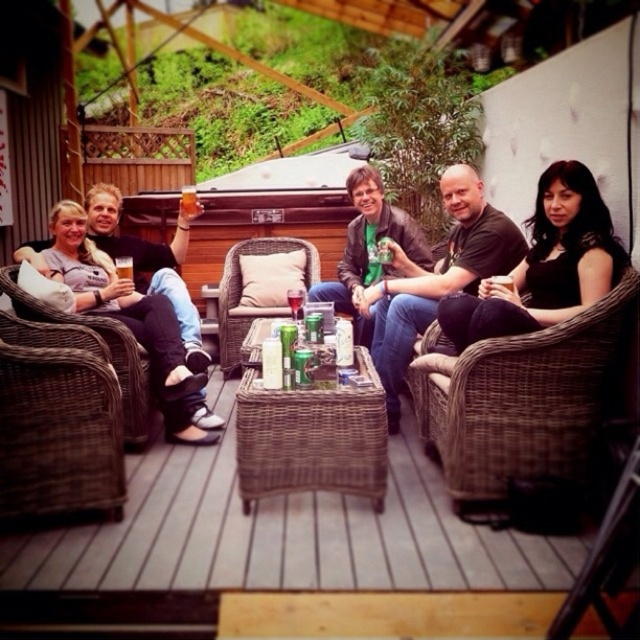
Does green leather jacket at center appear under green matte can at center?

No.

Image resolution: width=640 pixels, height=640 pixels. What do you see at coordinates (369, 248) in the screenshot?
I see `green leather jacket at center` at bounding box center [369, 248].

Locate an element on the screen. green leather jacket at center is located at coordinates (369, 248).

Who is lower down, black leather jacket at center or translucent glass beer at center?

black leather jacket at center is below.

Does black leather jacket at center appear on the left side of translucent glass beer at center?

In fact, black leather jacket at center is to the right of translucent glass beer at center.

Is point (484, 264) closer to viewer compared to point (182, 211)?

That is True.

Where is `black leather jacket at center`? black leather jacket at center is located at coordinates (436, 276).

Consider the image. Who is positioned more to the right, brown wicker chair at lower left or black leather jacket at center?

black leather jacket at center is more to the right.

Which is more to the left, brown wicker chair at lower left or black leather jacket at center?

Positioned to the left is brown wicker chair at lower left.

Where is `brown wicker chair at lower left`? The height and width of the screenshot is (640, 640). brown wicker chair at lower left is located at coordinates (58, 422).